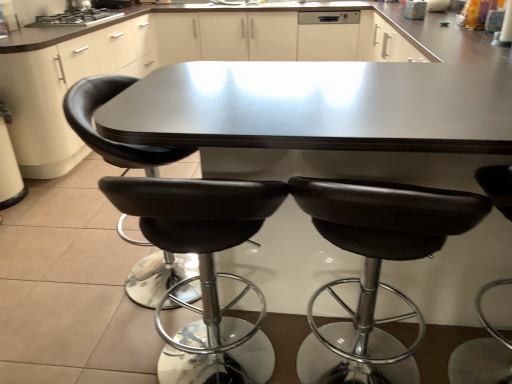
Describe the element at coordinates (110, 140) in the screenshot. Image resolution: width=512 pixels, height=384 pixels. I see `black leather stool at center, which is counted as the first chair, starting from the left` at that location.

Measure the distance between black leather chair at center, acting as the third chair starting from the right, and camera.

The depth of black leather chair at center, acting as the third chair starting from the right, is 1.44 meters.

Locate an element on the screen. This screenshot has height=384, width=512. stainless steel stove at upper left is located at coordinates (77, 17).

The width and height of the screenshot is (512, 384). Identify the location of white matte dishwasher at upper center. (328, 35).

Looking at this image, considering the relative sizes of white matte dishwasher at upper center and black leather stool at right, positioned as the first chair in right-to-left order, in the image provided, is white matte dishwasher at upper center taller than black leather stool at right, positioned as the first chair in right-to-left order,?

No, white matte dishwasher at upper center is not taller than black leather stool at right, positioned as the first chair in right-to-left order.

Considering the sizes of objects white matte dishwasher at upper center and black leather stool at right, arranged as the fourth chair when viewed from the left, in the image provided, who is bigger, white matte dishwasher at upper center or black leather stool at right, arranged as the fourth chair when viewed from the left,?

With larger size is black leather stool at right, arranged as the fourth chair when viewed from the left.

Is white matte dishwasher at upper center touching black leather stool at right, positioned as the first chair in right-to-left order?

white matte dishwasher at upper center is not next to black leather stool at right, positioned as the first chair in right-to-left order, and they're not touching.

From the image's perspective, is white matte dishwasher at upper center above or below black leather stool at right, positioned as the first chair in right-to-left order?

white matte dishwasher at upper center is above black leather stool at right, positioned as the first chair in right-to-left order.

Is black leather chair at center, acting as the third chair starting from the right, situated inside black leather stool at center, which is counted as the first chair, starting from the left, or outside?

black leather chair at center, acting as the third chair starting from the right, is outside black leather stool at center, which is counted as the first chair, starting from the left.

In the image, there is a black leather chair at center, acting as the third chair starting from the right. Where is `chair above it (from the image's perspective)`? chair above it (from the image's perspective) is located at coordinates (110, 140).

Is black leather chair at center, which ranks as the 2th chair in left-to-right order, oriented towards black leather stool at center, acting as the fourth chair starting from the right?

No, black leather chair at center, which ranks as the 2th chair in left-to-right order, is not oriented towards black leather stool at center, acting as the fourth chair starting from the right.

From the image's perspective, is black leather stool at center, acting as the fourth chair starting from the right, located above or below white matte dishwasher at upper center?

black leather stool at center, acting as the fourth chair starting from the right, is situated lower than white matte dishwasher at upper center in the image.

Is black leather stool at center, acting as the fourth chair starting from the right, facing towards white matte dishwasher at upper center?

No, black leather stool at center, acting as the fourth chair starting from the right, is not facing towards white matte dishwasher at upper center.

From the picture: Between black leather stool at center, acting as the fourth chair starting from the right, and white matte dishwasher at upper center, which one has larger size?

black leather stool at center, acting as the fourth chair starting from the right.

Considering the relative sizes of black leather stool at center, acting as the fourth chair starting from the right, and white matte dishwasher at upper center in the image provided, is black leather stool at center, acting as the fourth chair starting from the right, taller than white matte dishwasher at upper center?

Yes.

Can you confirm if stainless steel stove at upper left is wider than white matte dishwasher at upper center?

Correct, the width of stainless steel stove at upper left exceeds that of white matte dishwasher at upper center.

Considering the points (76, 24) and (335, 37), which point is in front, point (76, 24) or point (335, 37)?

The point (76, 24) is more forward.

Between stainless steel stove at upper left and white matte dishwasher at upper center, which one is positioned behind?

white matte dishwasher at upper center is behind.

Is white matte dishwasher at upper center a part of stainless steel stove at upper left?

No, white matte dishwasher at upper center is not a part of stainless steel stove at upper left.

Are black leather chair at center, which ranks as the 2th chair in left-to-right order, and stainless steel stove at upper left beside each other?

No, black leather chair at center, which ranks as the 2th chair in left-to-right order, is not with stainless steel stove at upper left.

Is black leather chair at center, acting as the third chair starting from the right, inside or outside of stainless steel stove at upper left?

black leather chair at center, acting as the third chair starting from the right, exists outside the volume of stainless steel stove at upper left.

From a real-world perspective, is black leather chair at center, which ranks as the 2th chair in left-to-right order, located higher than stainless steel stove at upper left?

Incorrect, from a real-world perspective, black leather chair at center, which ranks as the 2th chair in left-to-right order, is lower than stainless steel stove at upper left.

Would you say black leather stool at center, which is counted as the first chair, starting from the left, is inside or outside stainless steel stove at upper left?

black leather stool at center, which is counted as the first chair, starting from the left, is spatially situated outside stainless steel stove at upper left.

Could you tell me if black leather stool at center, which is counted as the first chair, starting from the left, is facing stainless steel stove at upper left?

No, black leather stool at center, which is counted as the first chair, starting from the left, is not facing towards stainless steel stove at upper left.

Considering the positions of objects black leather stool at center, acting as the fourth chair starting from the right, and stainless steel stove at upper left in the image provided, who is more to the left, black leather stool at center, acting as the fourth chair starting from the right, or stainless steel stove at upper left?

stainless steel stove at upper left is more to the left.

How distant is white matte dishwasher at upper center from black leather stool at center, arranged as the 2th chair when viewed from the right?

white matte dishwasher at upper center and black leather stool at center, arranged as the 2th chair when viewed from the right, are 3.21 meters apart from each other.

From the image's perspective, who appears lower, white matte dishwasher at upper center or black leather stool at center, which is the third chair in left-to-right order?

black leather stool at center, which is the third chair in left-to-right order, from the image's perspective.

Where is `the 1st chair counting from the left of the white matte dishwasher at upper center`? The height and width of the screenshot is (384, 512). the 1st chair counting from the left of the white matte dishwasher at upper center is located at coordinates tap(378, 259).

Consider the image. Is the position of white matte dishwasher at upper center more distant than that of black leather stool at center, arranged as the 2th chair when viewed from the right?

Yes, white matte dishwasher at upper center is further from the viewer.

From the white matte dishwasher at upper center, count 4th chairs forward and point to it. Please provide its 2D coordinates.

[(483, 352)]

Locate an element on the screen. The width and height of the screenshot is (512, 384). chair on the left of black leather chair at center, acting as the third chair starting from the right is located at coordinates (110, 140).

From the image, which object appears to be nearer to white matte dishwasher at upper center, black leather stool at center, acting as the fourth chair starting from the right, or stainless steel stove at upper left?

The object closer to white matte dishwasher at upper center is stainless steel stove at upper left.

When comparing their distances from black leather stool at center, which is counted as the first chair, starting from the left, does white matte dishwasher at upper center or black leather stool at center, which is the third chair in left-to-right order, seem further?

white matte dishwasher at upper center.

From the image, which object appears to be farther from stainless steel stove at upper left, shiny dark wood table at center or black leather chair at center, acting as the third chair starting from the right?

black leather chair at center, acting as the third chair starting from the right, is positioned further to the anchor stainless steel stove at upper left.

Looking at the image, which one is located closer to shiny dark wood table at center, black leather stool at center, arranged as the 2th chair when viewed from the right, or white matte dishwasher at upper center?

black leather stool at center, arranged as the 2th chair when viewed from the right, lies closer to shiny dark wood table at center than the other object.

Which object lies nearer to the anchor point black leather stool at center, which is counted as the first chair, starting from the left, white matte dishwasher at upper center or black leather stool at right, arranged as the fourth chair when viewed from the left?

black leather stool at right, arranged as the fourth chair when viewed from the left, is positioned closer to the anchor black leather stool at center, which is counted as the first chair, starting from the left.

Considering their positions, is shiny dark wood table at center positioned further to black leather chair at center, which ranks as the 2th chair in left-to-right order, than black leather stool at center, arranged as the 2th chair when viewed from the right?

Based on the image, shiny dark wood table at center appears to be further to black leather chair at center, which ranks as the 2th chair in left-to-right order.

Estimate the real-world distances between objects in this image. Which object is further from stainless steel stove at upper left, shiny dark wood table at center or black leather stool at center, arranged as the 2th chair when viewed from the right?

black leather stool at center, arranged as the 2th chair when viewed from the right.

Looking at the image, which one is located closer to black leather stool at right, positioned as the first chair in right-to-left order, stainless steel stove at upper left or shiny dark wood table at center?

shiny dark wood table at center is positioned closer to the anchor black leather stool at right, positioned as the first chair in right-to-left order.

You are a GUI agent. You are given a task and a screenshot of the screen. Output one action in this format:
    pyautogui.click(x=<x>, y=<y>)
    Task: Click on the table between black leather stool at right, positioned as the first chair in right-to-left order, and white matte dishwasher at upper center in the front-back direction
    
    Given the screenshot: What is the action you would take?
    pyautogui.click(x=322, y=118)

What are the coordinates of `table positioned between black leather chair at center, which ranks as the 2th chair in left-to-right order, and white matte dishwasher at upper center from near to far` in the screenshot? It's located at (322, 118).

This screenshot has height=384, width=512. I want to click on chair between black leather chair at center, acting as the third chair starting from the right, and black leather stool at right, positioned as the first chair in right-to-left order, from left to right, so click(378, 259).

At what (x,y) coordinates should I click in order to perform the action: click on table between black leather stool at center, arranged as the 2th chair when viewed from the right, and white matte dishwasher at upper center in the front-back direction. Please return your answer as a coordinate pair (x, y). This screenshot has height=384, width=512. Looking at the image, I should click on (322, 118).